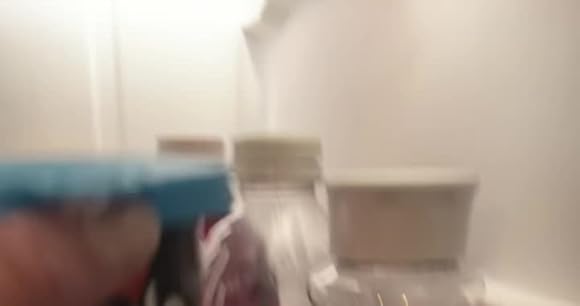
Find the location of a particular element. plastic container is located at coordinates (411, 287).